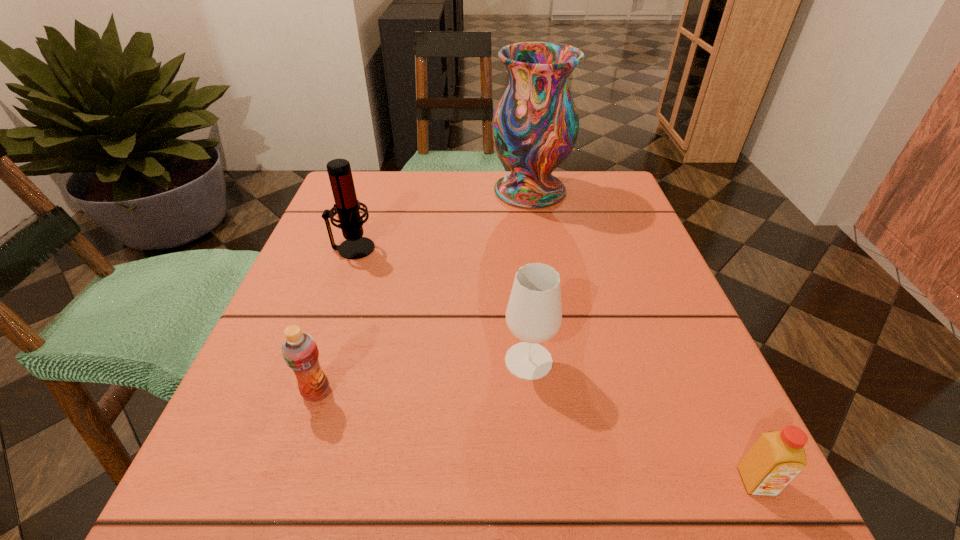
Locate an element on the screen. Image resolution: width=960 pixels, height=540 pixels. blank space at the far edge of the desktop is located at coordinates click(x=448, y=180).

In the image, there is a desktop. Identify the location of free space at the near edge. (529, 527).

Identify the location of vacant space at the left edge of the desktop. The image size is (960, 540). (347, 381).

The image size is (960, 540). I want to click on free spot at the right edge of the desktop, so click(x=569, y=225).

This screenshot has height=540, width=960. Identify the location of vacant space at the far left corner of the desktop. (391, 206).

Find the location of a particular element. This screenshot has width=960, height=540. free region at the far right corner of the desktop is located at coordinates (629, 216).

In the image, there is a desktop. Where is `vacant space at the near right corner`? This screenshot has width=960, height=540. vacant space at the near right corner is located at coordinates (722, 480).

Where is `empty location between the microphone and the taller orange juice`? The height and width of the screenshot is (540, 960). empty location between the microphone and the taller orange juice is located at coordinates (335, 320).

The width and height of the screenshot is (960, 540). Identify the location of free space between the glass and the fourth nearest object. (441, 305).

Where is `free space between the tallest object and the second farthest object`? The height and width of the screenshot is (540, 960). free space between the tallest object and the second farthest object is located at coordinates (442, 219).